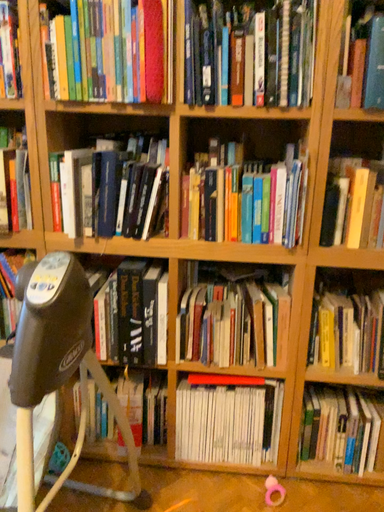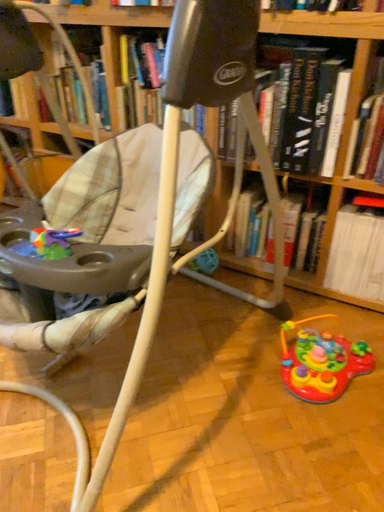
Question: Which way did the camera rotate in the video?

Choices:
 (A) rotated left
 (B) rotated right

Answer: (A)